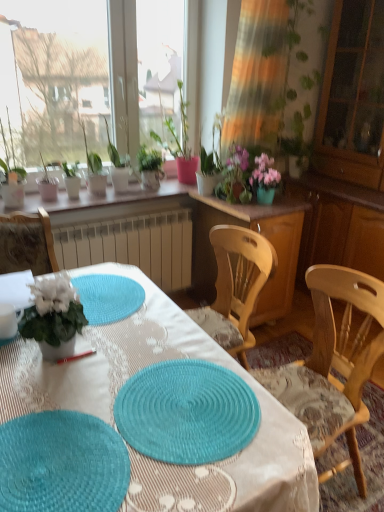
What is the approximate width of teal woven mat at lower left, positioned as the 2th mat in right-to-left order?

37.89 centimeters.

At what (x,y) coordinates should I click in order to perform the action: click on teal woven mat at lower left, positioned as the 2th mat in right-to-left order. Please return your answer as a coordinate pair (x, y). The image size is (384, 512). Looking at the image, I should click on (62, 464).

Describe the element at coordinates (94, 169) in the screenshot. I see `green leafy plant at upper left, the third houseplant when ordered from left to right` at that location.

Measure the distance between white ceramic pots at upper center and camera.

white ceramic pots at upper center and camera are 2.21 meters apart.

Describe the element at coordinates (71, 180) in the screenshot. Image resolution: width=384 pixels, height=512 pixels. I see `matte white pot at upper left, the 5th houseplant positioned from the right` at that location.

What is the approximate width of teal woven placemat at center, arranged as the 1th mat when viewed from the right?

38.29 centimeters.

The width and height of the screenshot is (384, 512). What are the coordinates of `white matte plant at left, the 5th houseplant from the left` in the screenshot? It's located at (54, 317).

The height and width of the screenshot is (512, 384). Find the location of `teal woven mat at lower left, which is the 1th mat in left-to-right order`. teal woven mat at lower left, which is the 1th mat in left-to-right order is located at coordinates (62, 464).

How many degrees apart are the facing directions of matte white pot at center, which is the 1th houseplant from right to left, and teal woven placemat at center, the 2th mat positioned from the left?

The angular difference between matte white pot at center, which is the 1th houseplant from right to left, and teal woven placemat at center, the 2th mat positioned from the left, is 1.93 degrees.

Consider the image. Does matte white pot at center, which ranks as the sixth houseplant in left-to-right order, have a lesser height compared to teal woven placemat at center, arranged as the 1th mat when viewed from the right?

In fact, matte white pot at center, which ranks as the sixth houseplant in left-to-right order, may be taller than teal woven placemat at center, arranged as the 1th mat when viewed from the right.

In the image, is matte white pot at center, which is the 1th houseplant from right to left, positioned in front of or behind teal woven placemat at center, arranged as the 1th mat when viewed from the right?

Visually, matte white pot at center, which is the 1th houseplant from right to left, is located behind teal woven placemat at center, arranged as the 1th mat when viewed from the right.

Which of these two, green leafy plant at upper left, the third houseplant when ordered from left to right, or pink matte flower pot at upper center, is wider?

Wider between the two is green leafy plant at upper left, the third houseplant when ordered from left to right.

Is green leafy plant at upper left, the 4th houseplant in the right-to-left sequence, not within pink matte flower pot at upper center?

Indeed, green leafy plant at upper left, the 4th houseplant in the right-to-left sequence, is completely outside pink matte flower pot at upper center.

Does green leafy plant at upper left, the 4th houseplant in the right-to-left sequence, have a lesser height compared to pink matte flower pot at upper center?

No.

Who is taller, matte white pot at upper left, the 5th houseplant positioned from the right, or matte white pot at center, which is the 1th houseplant from right to left?

Standing taller between the two is matte white pot at center, which is the 1th houseplant from right to left.

From a real-world perspective, is matte white pot at upper left, positioned as the 2th houseplant in left-to-right order, located beneath matte white pot at center, which ranks as the sixth houseplant in left-to-right order?

Correct, in the physical world, matte white pot at upper left, positioned as the 2th houseplant in left-to-right order, is lower than matte white pot at center, which ranks as the sixth houseplant in left-to-right order.

Is matte white pot at center, which ranks as the sixth houseplant in left-to-right order, at the back of matte white pot at upper left, the 5th houseplant positioned from the right?

No, matte white pot at upper left, the 5th houseplant positioned from the right,'s orientation is not away from matte white pot at center, which ranks as the sixth houseplant in left-to-right order.

Can you confirm if green matte plant at left, positioned as the 6th houseplant in right-to-left order, is bigger than wooden cabinet at center?

Actually, green matte plant at left, positioned as the 6th houseplant in right-to-left order, might be smaller than wooden cabinet at center.

Find the location of `cabinetry below the green matte plant at left, the first houseplant positioned from the left (from the image's perspective)`. cabinetry below the green matte plant at left, the first houseplant positioned from the left (from the image's perspective) is located at coordinates tap(261, 234).

From their relative heights in the image, would you say green matte plant at left, positioned as the 6th houseplant in right-to-left order, is taller or shorter than wooden cabinet at center?

Considering their sizes, green matte plant at left, positioned as the 6th houseplant in right-to-left order, has less height than wooden cabinet at center.

Does green matte plant at left, positioned as the 6th houseplant in right-to-left order, have a lesser width compared to wooden cabinet at center?

Yes, green matte plant at left, positioned as the 6th houseplant in right-to-left order, is thinner than wooden cabinet at center.

Is green leafy plant at upper left, which ranks as the third houseplant in right-to-left order, far from matte white pot at center, which is the 1th houseplant from right to left?

They are positioned close to each other.

Considering the positions of objects green leafy plant at upper left, the 4th houseplant positioned from the left, and matte white pot at center, which ranks as the sixth houseplant in left-to-right order, in the image provided, who is in front, green leafy plant at upper left, the 4th houseplant positioned from the left, or matte white pot at center, which ranks as the sixth houseplant in left-to-right order,?

matte white pot at center, which ranks as the sixth houseplant in left-to-right order.

Is green leafy plant at upper left, the 4th houseplant positioned from the left, completely or partially outside of matte white pot at center, which ranks as the sixth houseplant in left-to-right order?

green leafy plant at upper left, the 4th houseplant positioned from the left, is positioned outside matte white pot at center, which ranks as the sixth houseplant in left-to-right order.

From a real-world perspective, is green leafy plant at upper left, the 4th houseplant positioned from the left, positioned above or below matte white pot at center, which ranks as the sixth houseplant in left-to-right order?

green leafy plant at upper left, the 4th houseplant positioned from the left, is below matte white pot at center, which ranks as the sixth houseplant in left-to-right order.

Between teal woven placemat at center and white ceramic pots at upper center, which one has larger size?

teal woven placemat at center is bigger.

Is teal woven placemat at center in front of or behind white ceramic pots at upper center in the image?

teal woven placemat at center is in front of white ceramic pots at upper center.

Is teal woven placemat at center directly adjacent to white ceramic pots at upper center?

They are not placed beside each other.

Are pink matte flower pot at upper center and transparent glass cabinet at right located far from each other?

No.

Considering the positions of objects pink matte flower pot at upper center and transparent glass cabinet at right in the image provided, who is more to the right, pink matte flower pot at upper center or transparent glass cabinet at right?

From the viewer's perspective, transparent glass cabinet at right appears more on the right side.

Can transparent glass cabinet at right be found inside pink matte flower pot at upper center?

No, pink matte flower pot at upper center does not contain transparent glass cabinet at right.

From the image's perspective, between pink matte flower pot at upper center and transparent glass cabinet at right, who is located below?

pink matte flower pot at upper center appears lower in the image.

Where is `mat that is the 1st one when counting downward from the matte white pot at center, which is the 1th houseplant from right to left (from the image's perspective)`? This screenshot has height=512, width=384. mat that is the 1st one when counting downward from the matte white pot at center, which is the 1th houseplant from right to left (from the image's perspective) is located at coordinates (187, 412).

Where is `flower beneath the green leafy plant at upper left, the third houseplant when ordered from left to right (from a real-world perspective)`? Image resolution: width=384 pixels, height=512 pixels. flower beneath the green leafy plant at upper left, the third houseplant when ordered from left to right (from a real-world perspective) is located at coordinates (264, 173).

Considering their positions, is white ceramic pots at upper center positioned further to wooden chair at center than white matte plant at left, the 5th houseplant from the left?

white ceramic pots at upper center is further to wooden chair at center.

Looking at the image, which one is located further to matte white pot at center, which is the 1th houseplant from right to left, pink matte flower pot at upper center or transparent glass cabinet at right?

The object further to matte white pot at center, which is the 1th houseplant from right to left, is transparent glass cabinet at right.

Based on their spatial positions, is green leafy plant at upper left, the third houseplant when ordered from left to right, or green matte plant at left, positioned as the 6th houseplant in right-to-left order, further from matte white pot at center, which is the 1th houseplant from right to left?

The object further to matte white pot at center, which is the 1th houseplant from right to left, is green matte plant at left, positioned as the 6th houseplant in right-to-left order.

From the image, which object appears to be nearer to green leafy plant at upper left, the third houseplant when ordered from left to right, wooden chair at center or pink matte flower pot at upper center?

Based on the image, pink matte flower pot at upper center appears to be nearer to green leafy plant at upper left, the third houseplant when ordered from left to right.

Which object lies nearer to the anchor point white ceramic pots at upper center, matte white pot at upper left, the 5th houseplant positioned from the right, or white matte plant at left, which appears as the second houseplant when viewed from the right?

matte white pot at upper left, the 5th houseplant positioned from the right, is positioned closer to the anchor white ceramic pots at upper center.

When comparing their distances from teal woven placemat at center, the 2th mat positioned from the left, does matte white pot at upper left, the 5th houseplant positioned from the right, or pink matte vase at center seem further?

matte white pot at upper left, the 5th houseplant positioned from the right.

Consider the image. When comparing their distances from pink matte flower pot at upper center, does matte white pot at upper left, positioned as the 2th houseplant in left-to-right order, or teal woven placemat at center, the 2th mat positioned from the left, seem closer?

matte white pot at upper left, positioned as the 2th houseplant in left-to-right order.

Looking at the image, which one is located closer to pink matte vase at center, green leafy plant at upper left, the 4th houseplant positioned from the left, or wooden chair at center?

Based on the image, green leafy plant at upper left, the 4th houseplant positioned from the left, appears to be nearer to pink matte vase at center.

In order to click on window sill between teal woven placemat at center and matte white pot at upper left, the 5th houseplant positioned from the right, in the front-back direction in this screenshot , I will do `click(111, 202)`.

Find the location of `cabinetry positioned between teal woven mat at lower left, which is the 1th mat in left-to-right order, and pink matte vase at center from near to far`. cabinetry positioned between teal woven mat at lower left, which is the 1th mat in left-to-right order, and pink matte vase at center from near to far is located at coordinates (261, 234).

Locate an element on the screen. Image resolution: width=384 pixels, height=512 pixels. cabinetry between teal woven placemat at center and pink matte vase at center along the z-axis is located at coordinates (261, 234).

Where is `window sill between wooden chair at center and matte white pot at upper left, positioned as the 2th houseplant in left-to-right order, in the front-back direction`? window sill between wooden chair at center and matte white pot at upper left, positioned as the 2th houseplant in left-to-right order, in the front-back direction is located at coordinates (111, 202).